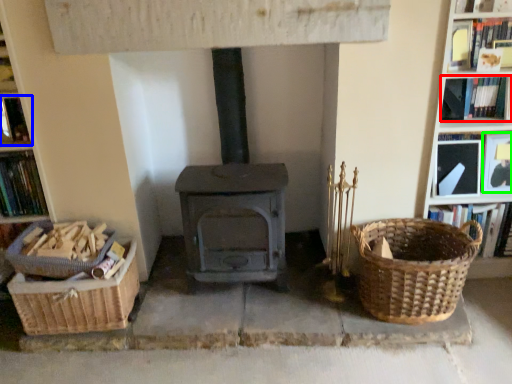
Question: Which is farther away from book (highlighted by a red box)? book (highlighted by a blue box) or book (highlighted by a green box)?

Choices:
 (A) book
 (B) book

Answer: (A)